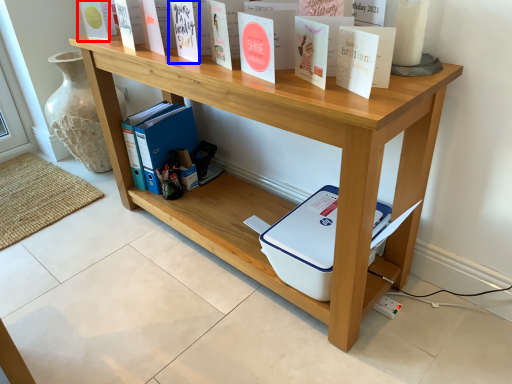
Question: Which point is closer to the camera, paperback book (highlighted by a red box) or paperback book (highlighted by a blue box)?

Choices:
 (A) paperback book
 (B) paperback book

Answer: (B)